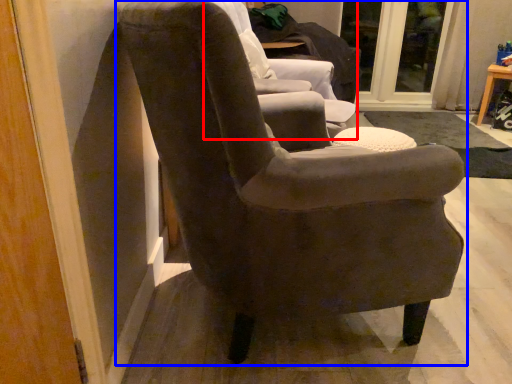
Question: Among these objects, which one is nearest to the camera, chair (highlighted by a red box) or chair (highlighted by a blue box)?

Choices:
 (A) chair
 (B) chair

Answer: (B)